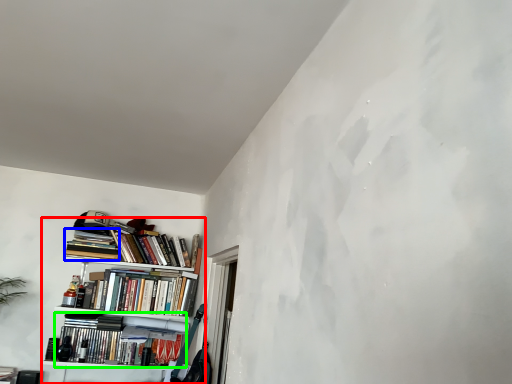
Question: Which object is positioned closest to bookcase (highlighted by a red box)? Select from book (highlighted by a blue box) and book (highlighted by a green box).

Choices:
 (A) book
 (B) book

Answer: (B)